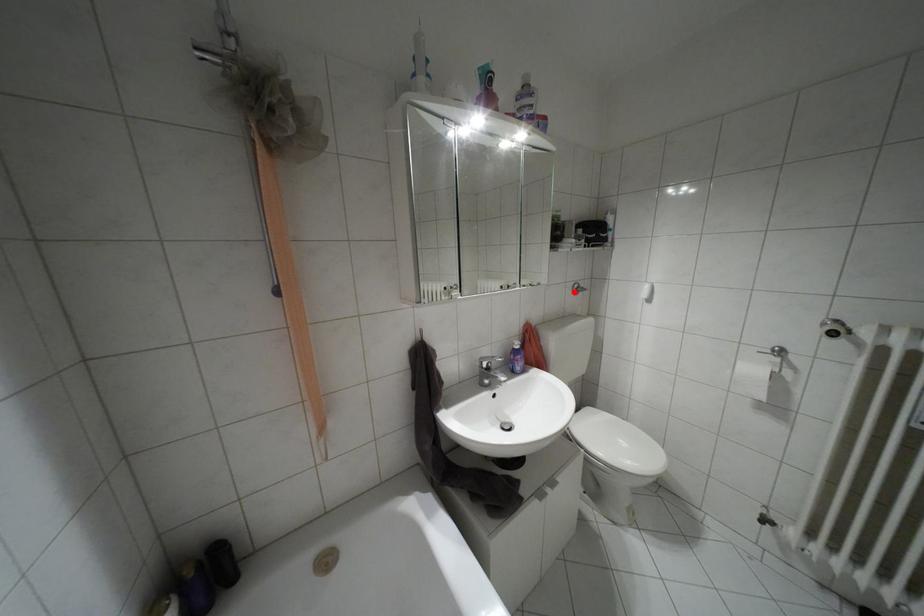
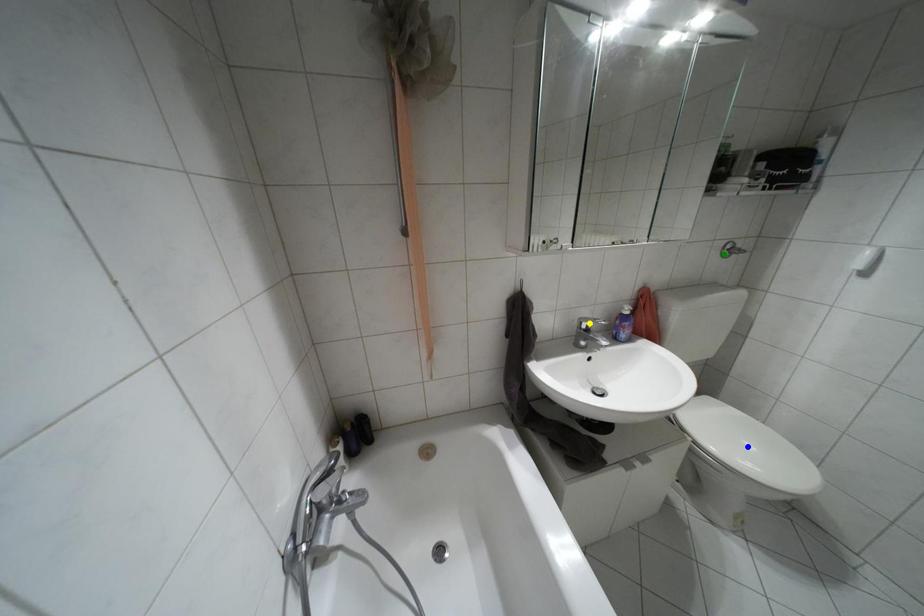
Question: I am providing you with two images of the same scene from different viewpoints. A red point is marked on the first image. You are given multiple points on the second image. Which point in image 2 is actually the same real-world point as the red point in image 1?

Choices:
 (A) yellow point
 (B) blue point
 (C) green point

Answer: (C)